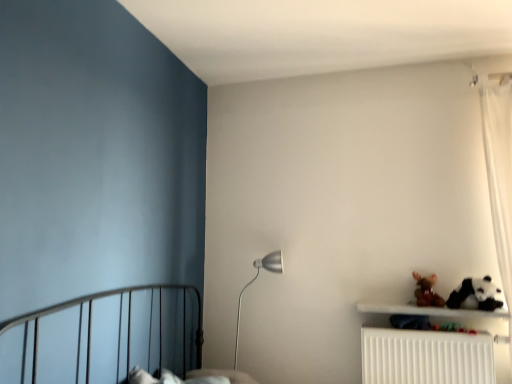
Question: Can you confirm if white plastic radiator at lower right is taller than white plush panda at lower right?

Choices:
 (A) yes
 (B) no

Answer: (A)

Question: Can you confirm if white plastic radiator at lower right is wider than white plush panda at lower right?

Choices:
 (A) no
 (B) yes

Answer: (A)

Question: Is white plastic radiator at lower right at the left side of white plush panda at lower right?

Choices:
 (A) no
 (B) yes

Answer: (B)

Question: Considering the relative sizes of white plastic radiator at lower right and white plush panda at lower right in the image provided, is white plastic radiator at lower right thinner than white plush panda at lower right?

Choices:
 (A) no
 (B) yes

Answer: (B)

Question: Does white plastic radiator at lower right have a smaller size compared to white plush panda at lower right?

Choices:
 (A) yes
 (B) no

Answer: (B)

Question: In terms of size, does brown plush toy at upper right appear bigger or smaller than white plush panda at lower right?

Choices:
 (A) small
 (B) big

Answer: (A)

Question: From a real-world perspective, is brown plush toy at upper right physically located above or below white plush panda at lower right?

Choices:
 (A) below
 (B) above

Answer: (B)

Question: From the image's perspective, is brown plush toy at upper right positioned above or below white plush panda at lower right?

Choices:
 (A) below
 (B) above

Answer: (A)

Question: In terms of height, does brown plush toy at upper right look taller or shorter compared to white plush panda at lower right?

Choices:
 (A) tall
 (B) short

Answer: (B)

Question: From their relative heights in the image, would you say white plush panda at lower right is taller or shorter than white plastic radiator at lower right?

Choices:
 (A) short
 (B) tall

Answer: (A)

Question: From a real-world perspective, is white plush panda at lower right physically located above or below white plastic radiator at lower right?

Choices:
 (A) below
 (B) above

Answer: (B)

Question: Is white plush panda at lower right to the left or to the right of white plastic radiator at lower right in the image?

Choices:
 (A) left
 (B) right

Answer: (B)

Question: In terms of width, does white plush panda at lower right look wider or thinner when compared to white plastic radiator at lower right?

Choices:
 (A) wide
 (B) thin

Answer: (A)

Question: In terms of size, does white plastic radiator at lower right appear bigger or smaller than white plush panda at lower right?

Choices:
 (A) small
 (B) big

Answer: (B)

Question: Do you think white plastic radiator at lower right is within white plush panda at lower right, or outside of it?

Choices:
 (A) outside
 (B) inside

Answer: (A)